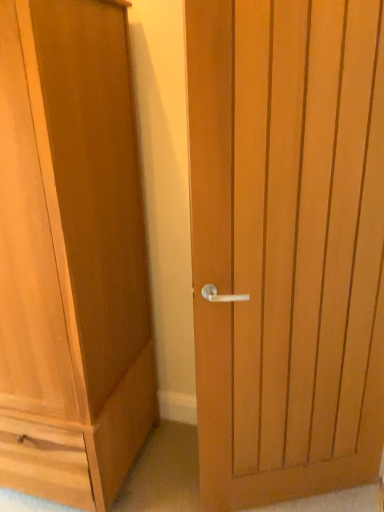
Question: Should I look upward or downward to see light brown wood cupboard at left?

Choices:
 (A) up
 (B) down

Answer: (B)

Question: From the image's perspective, is light brown wood door at center beneath light brown wood cupboard at left?

Choices:
 (A) yes
 (B) no

Answer: (A)

Question: Is light brown wood door at center directly adjacent to light brown wood cupboard at left?

Choices:
 (A) no
 (B) yes

Answer: (A)

Question: Are light brown wood door at center and light brown wood cupboard at left located far from each other?

Choices:
 (A) no
 (B) yes

Answer: (A)

Question: Considering the relative positions of light brown wood door at center and light brown wood cupboard at left in the image provided, is light brown wood door at center to the right of light brown wood cupboard at left from the viewer's perspective?

Choices:
 (A) yes
 (B) no

Answer: (A)

Question: Does light brown wood door at center have a greater height compared to light brown wood cupboard at left?

Choices:
 (A) no
 (B) yes

Answer: (A)

Question: Is light brown wood door at center looking in the opposite direction of light brown wood cupboard at left?

Choices:
 (A) no
 (B) yes

Answer: (A)

Question: Is light brown wood cupboard at left shorter than light brown wood door at center?

Choices:
 (A) no
 (B) yes

Answer: (A)

Question: From a real-world perspective, is light brown wood cupboard at left on top of light brown wood door at center?

Choices:
 (A) yes
 (B) no

Answer: (A)

Question: From the image's perspective, is light brown wood cupboard at left located beneath light brown wood door at center?

Choices:
 (A) yes
 (B) no

Answer: (B)

Question: Does light brown wood cupboard at left lie in front of light brown wood door at center?

Choices:
 (A) no
 (B) yes

Answer: (B)

Question: Can you confirm if light brown wood cupboard at left is wider than light brown wood door at center?

Choices:
 (A) no
 (B) yes

Answer: (B)

Question: Considering the relative sizes of light brown wood cupboard at left and light brown wood door at center in the image provided, is light brown wood cupboard at left smaller than light brown wood door at center?

Choices:
 (A) no
 (B) yes

Answer: (A)

Question: Do you think light brown wood door at center is within light brown wood cupboard at left, or outside of it?

Choices:
 (A) inside
 (B) outside

Answer: (B)